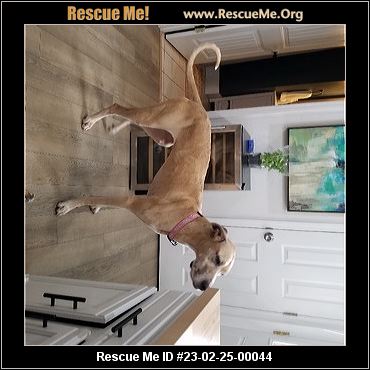
Locate an element on the screen. Image resolution: width=370 pixels, height=370 pixels. door hinge is located at coordinates (284, 333), (294, 313).